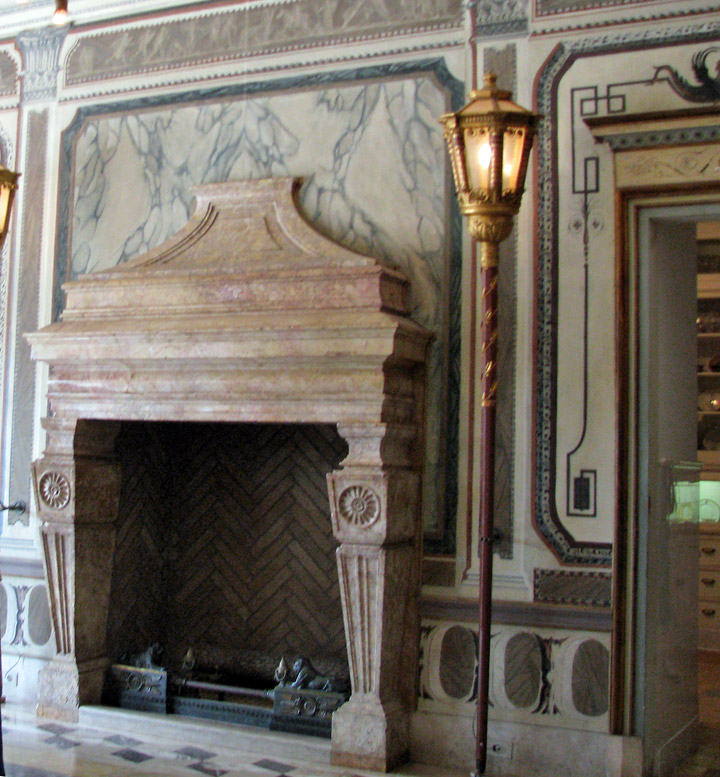
The height and width of the screenshot is (777, 720). I want to click on marble, so click(361, 162).